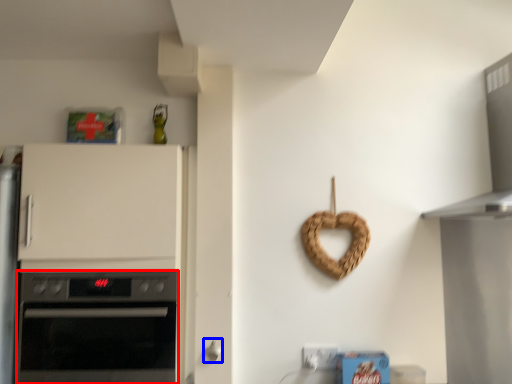
Question: Which of the following is the closest to the observer, oven (highlighted by a red box) or door handle (highlighted by a blue box)?

Choices:
 (A) oven
 (B) door handle

Answer: (A)